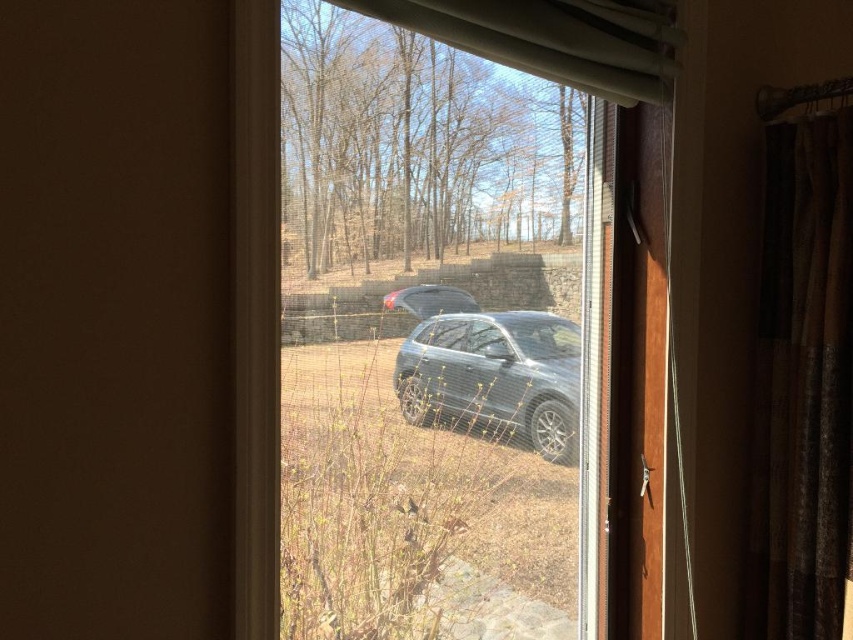
You are standing inside the house looking through the window. You see the satin black suv at center and the white sheer curtain at upper center. Which object is closer to the bottom edge of the window frame?

The satin black suv at center is closer to the bottom edge of the window frame because it is below the white sheer curtain at upper center.

You are an interior designer planning to install a new window treatment. The clear glass window at center is much taller than the satin black suv at center. Considering the height difference, which object would require a larger vertical space when installing the treatment?

The clear glass window at center requires more vertical space because it is much taller than the satin black suv at center.

You are standing 5 feet away from the brown textured curtain at right. Can you reach it without moving your feet?

The brown textured curtain at right is 4.41 feet away from the viewer. Since you are standing 5 feet away, you cannot reach it without moving your feet.